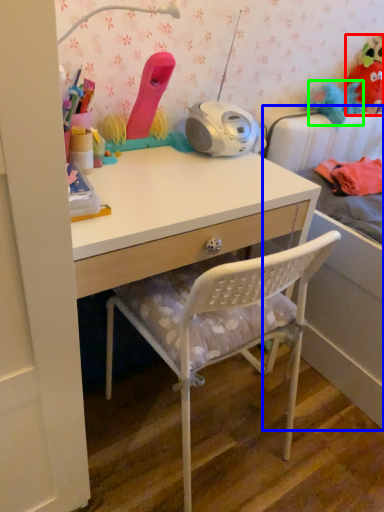
Question: Which object is positioned closest to toy (highlighted by a red box)? Select from bed (highlighted by a blue box) and toy (highlighted by a green box).

Choices:
 (A) bed
 (B) toy

Answer: (B)